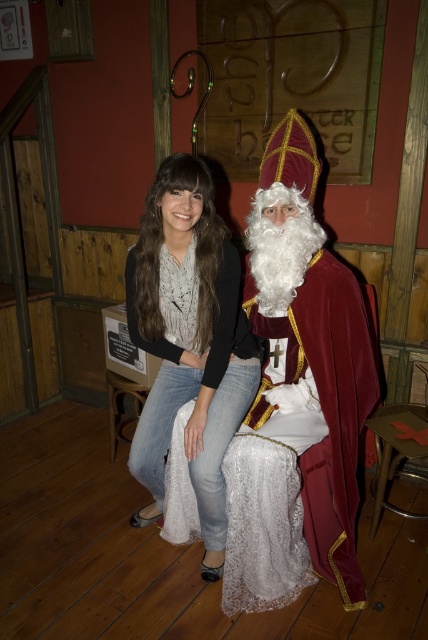
Is velvet maroon cape at center taller than denim jeans at center?

Correct, velvet maroon cape at center is much taller as denim jeans at center.

The image size is (428, 640). What do you see at coordinates (297, 396) in the screenshot?
I see `velvet maroon cape at center` at bounding box center [297, 396].

The image size is (428, 640). What are the coordinates of `velvet maroon cape at center` in the screenshot? It's located at [x=297, y=396].